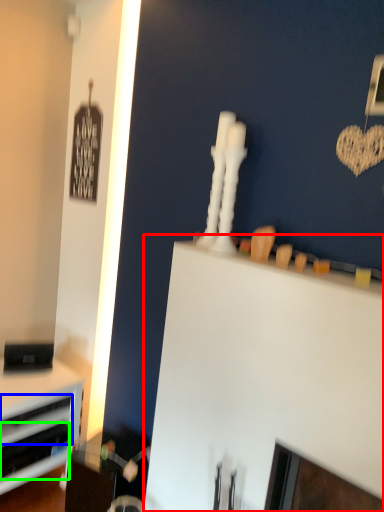
Question: Based on their relative distances, which object is farther from computer desk (highlighted by a red box)? Choose from drawer (highlighted by a blue box) and drawer (highlighted by a green box).

Choices:
 (A) drawer
 (B) drawer

Answer: (B)